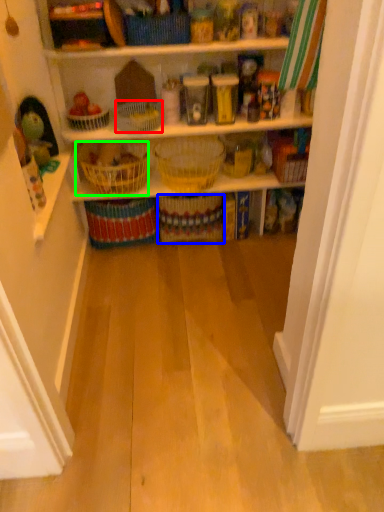
Question: Which is farther away from basket (highlighted by a red box)? basket (highlighted by a blue box) or basket (highlighted by a green box)?

Choices:
 (A) basket
 (B) basket

Answer: (A)